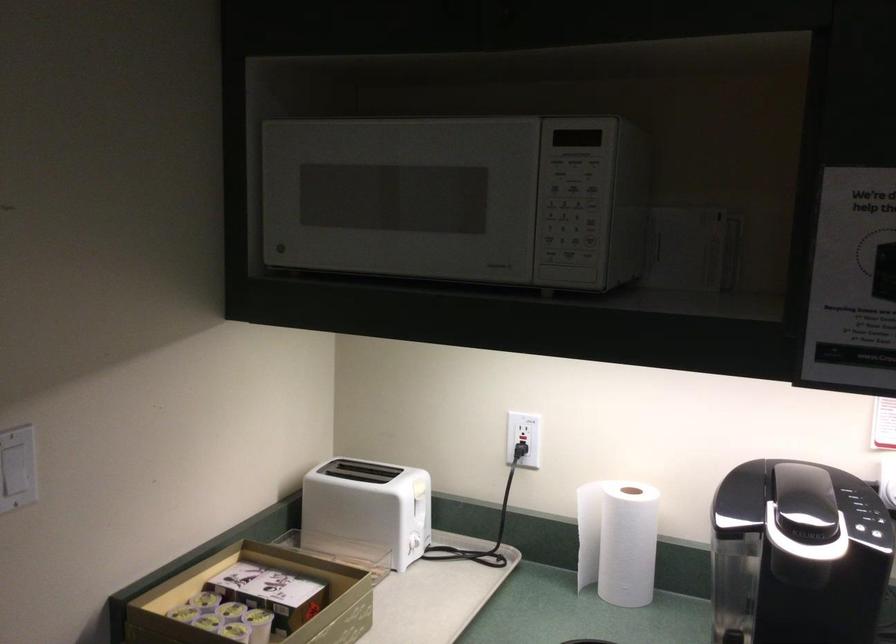
The width and height of the screenshot is (896, 644). What do you see at coordinates (872, 529) in the screenshot?
I see `the coffee machine button` at bounding box center [872, 529].